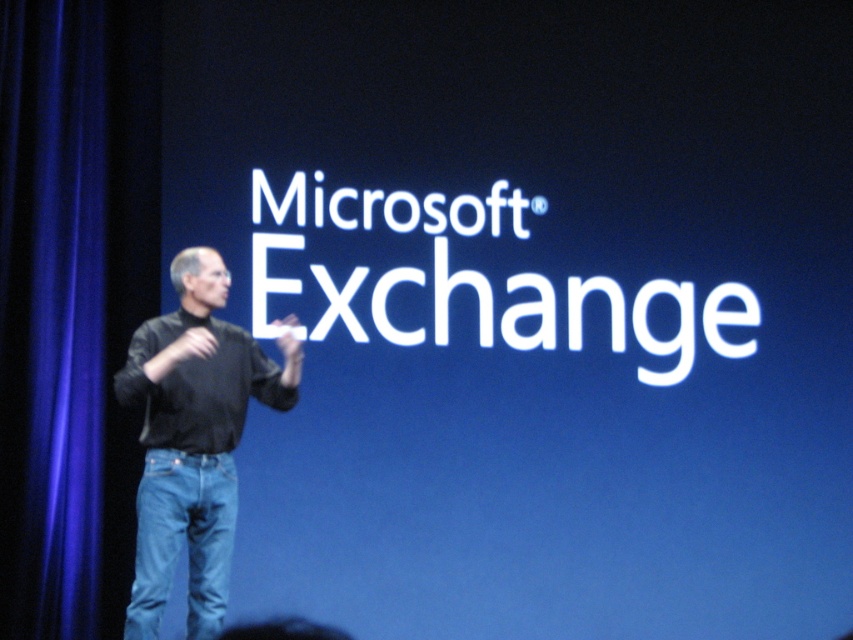
In the scene shown: You are an event photographer at the conference. You want to capture a photo of the black matte shirt at center without the blue velvet curtain at left being visible in the frame. Is this possible?

The blue velvet curtain at left is positioned over the black matte shirt at center, so it will be visible in the frame. To avoid capturing the curtain, you would need to adjust your angle or move closer to the presenter to exclude the curtain from the shot.

You are an event coordinator who needs to place a small podium for the presenter. The podium must be placed at the exact center of the stage. However, there is a blue velvet curtain at left located at point (51, 314). Is the podium placement at the center possible without overlapping the curtain?

The blue velvet curtain at left is located at point (51, 314). Since the podium needs to be placed at the exact center of the stage, which is different from the curtain location, the podium can be placed there without overlapping the curtain.